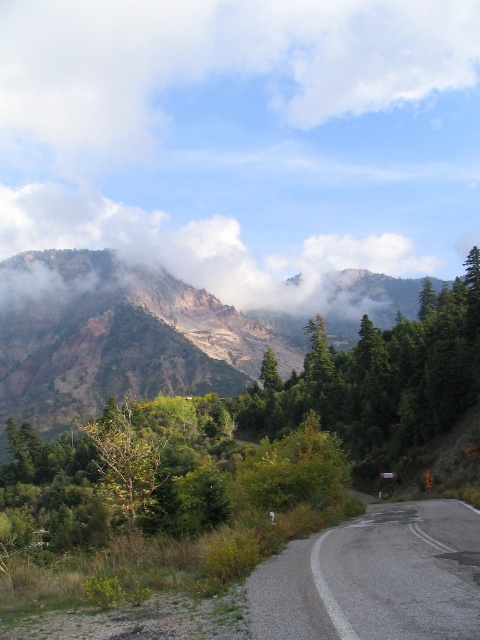
Question: Where is gray asphalt road at lower right located in relation to foggy misty mountain at upper center in the image?

Choices:
 (A) right
 (B) left

Answer: (A)

Question: Which point is closer to the camera?

Choices:
 (A) (112, 467)
 (B) (129, 84)

Answer: (A)

Question: Which point appears closest to the camera in this image?

Choices:
 (A) (299, 128)
 (B) (417, 557)

Answer: (B)

Question: Which object appears closest to the camera in this image?

Choices:
 (A) white fluffy cloud at upper center
 (B) rustic stone mountain at upper left
 (C) foggy misty mountain at upper center

Answer: (B)

Question: Does rustic stone mountain at upper left have a lesser width compared to foggy misty mountain at upper center?

Choices:
 (A) yes
 (B) no

Answer: (A)

Question: Is white fluffy cloud at upper center above green leafy tree at center?

Choices:
 (A) no
 (B) yes

Answer: (B)